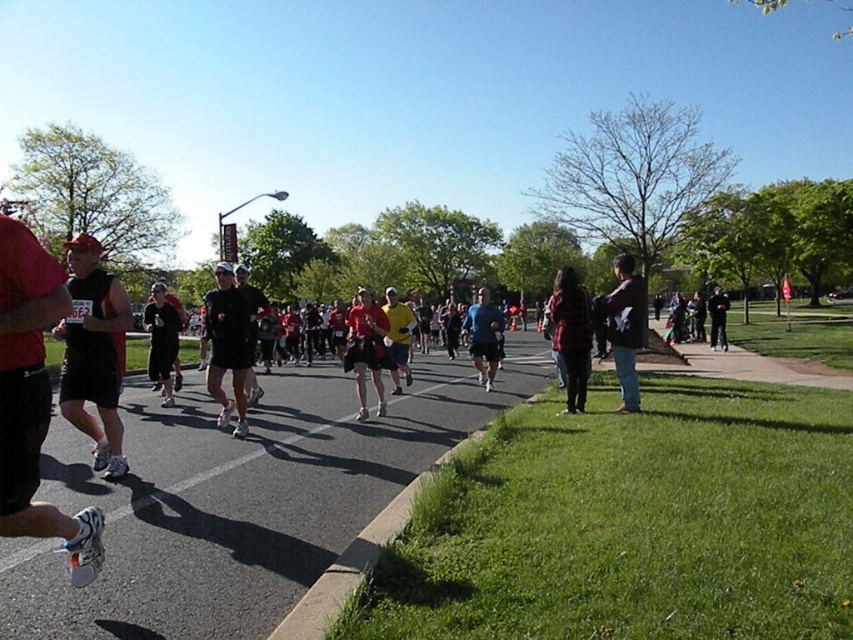
Question: Is matte red shorts at center below yellow fabric shirt at center?

Choices:
 (A) yes
 (B) no

Answer: (A)

Question: Based on their relative distances, which object is nearer to the yellow fabric shirt at center?

Choices:
 (A) matte red shorts at center
 (B) dark gray fabric jacket at center

Answer: (A)

Question: Can you confirm if matte red shorts at center is positioned below blue fabric shirt at center?

Choices:
 (A) no
 (B) yes

Answer: (B)

Question: Which object is farther from the camera taking this photo?

Choices:
 (A) matte black tank top at left
 (B) black leather jacket at right

Answer: (B)

Question: Which object is farther from the camera taking this photo?

Choices:
 (A) black matte shorts at center
 (B) flannel shirt at center
 (C) blue fabric shirt at center
 (D) matte red shorts at center

Answer: (C)

Question: Does dark gray fabric jacket at center appear under yellow fabric shirt at center?

Choices:
 (A) no
 (B) yes

Answer: (B)